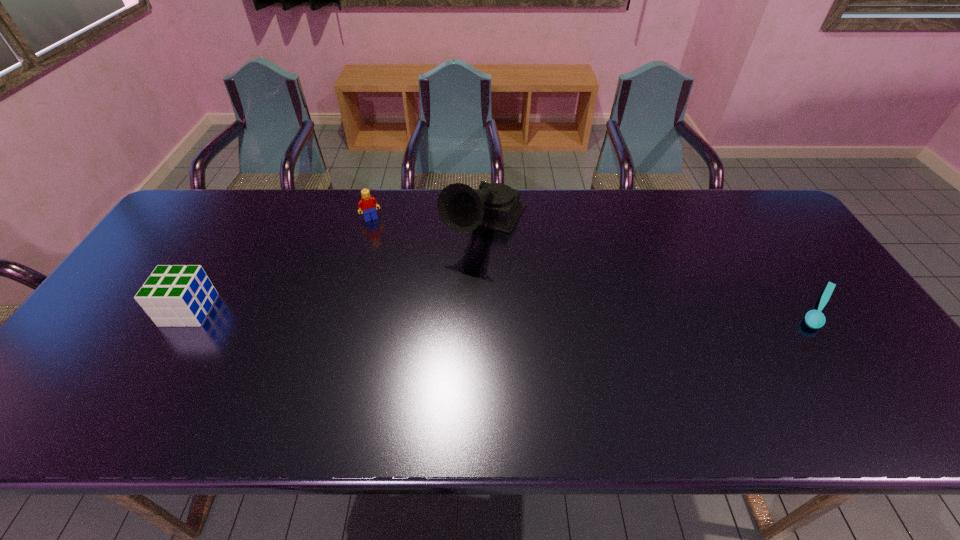
Where is `free space at the right edge of the desktop`? This screenshot has width=960, height=540. free space at the right edge of the desktop is located at coordinates (880, 352).

This screenshot has height=540, width=960. In order to click on free location at the far left corner of the desktop in this screenshot , I will do `click(226, 206)`.

Locate an element on the screen. vacant space at the far right corner of the desktop is located at coordinates (743, 208).

Locate an element on the screen. The image size is (960, 540). vacant space in between the shortest object and the leftmost object is located at coordinates tap(504, 309).

Find the location of a particular element. unoccupied position between the leftmost object and the third object from left to right is located at coordinates (338, 269).

I want to click on free point between the spoon and the phonograph_record, so click(x=653, y=268).

I want to click on free space between the phonograph_record and the cube, so click(338, 269).

Locate an element on the screen. vacant space that is in between the Lego and the tallest object is located at coordinates (428, 222).

What are the coordinates of `vacant area that lies between the second object from left to right and the leftmost object` in the screenshot? It's located at (280, 264).

Find the location of a particular element. free spot between the leftmost object and the spoon is located at coordinates (504, 309).